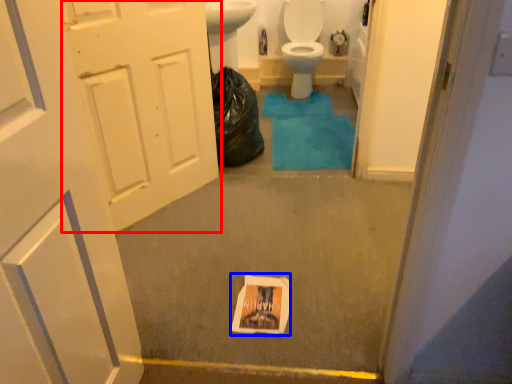
Question: Among these objects, which one is farthest to the camera, door (highlighted by a red box) or flyer (highlighted by a blue box)?

Choices:
 (A) door
 (B) flyer

Answer: (B)